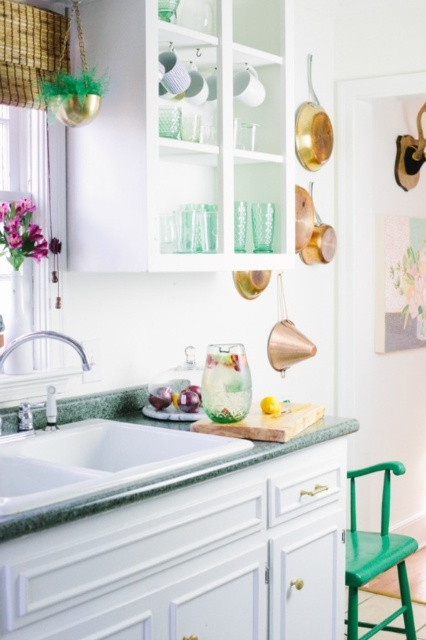
Question: Is green marble countertop at center below green matte stool at lower right?

Choices:
 (A) yes
 (B) no

Answer: (B)

Question: Based on their relative distances, which object is nearer to the satin nickel faucet at sink left?

Choices:
 (A) green matte stool at lower right
 (B) white ceramic sink at center

Answer: (B)

Question: Is green marble countertop at center positioned behind satin nickel faucet at sink left?

Choices:
 (A) no
 (B) yes

Answer: (A)

Question: Which object appears closest to the camera in this image?

Choices:
 (A) white ceramic sink at center
 (B) brushed metal faucet at lower left

Answer: (A)

Question: Does green matte stool at lower right appear on the right side of satin nickel faucet at sink left?

Choices:
 (A) no
 (B) yes

Answer: (B)

Question: Which point is closer to the camera taking this photo?

Choices:
 (A) (58, 470)
 (B) (45, 333)
 (C) (241, 608)
 (D) (347, 624)

Answer: (A)